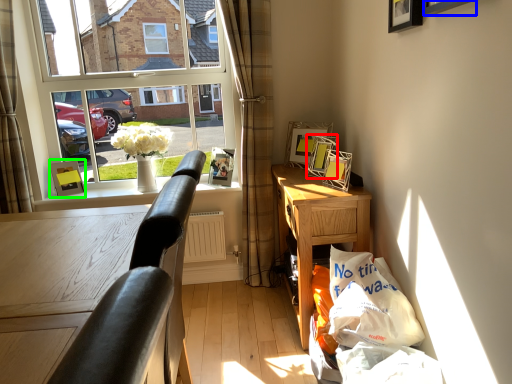
Question: Which object is the farthest from picture frame (highlighted by a red box)? Choose among these: picture frame (highlighted by a blue box) or picture frame (highlighted by a green box).

Choices:
 (A) picture frame
 (B) picture frame

Answer: (B)